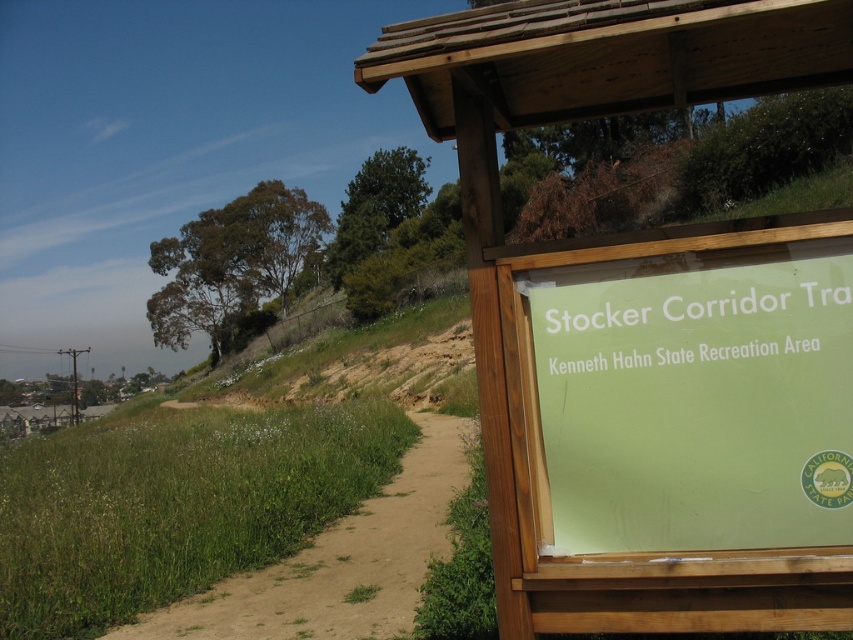
I want to click on green matte sign at right, so click(x=688, y=397).

Between green matte sign at right and brown sandy dirt track at lower left, which one has more height?

With more height is green matte sign at right.

Locate an element on the screen. The image size is (853, 640). green matte sign at right is located at coordinates (688, 397).

Find the location of a particular element. green matte sign at right is located at coordinates (688, 397).

Can you confirm if wooden sign at right is bigger than brown sandy dirt track at lower left?

No.

Where is `wooden sign at right`? wooden sign at right is located at coordinates (648, 330).

Between point (550, 513) and point (554, 548), which one is positioned behind?

The point (550, 513) is more distant.

Between wooden sign at right and green matte sign at right, which one appears on the right side from the viewer's perspective?

From the viewer's perspective, green matte sign at right appears more on the right side.

Identify the location of wooden sign at right. The width and height of the screenshot is (853, 640). (648, 330).